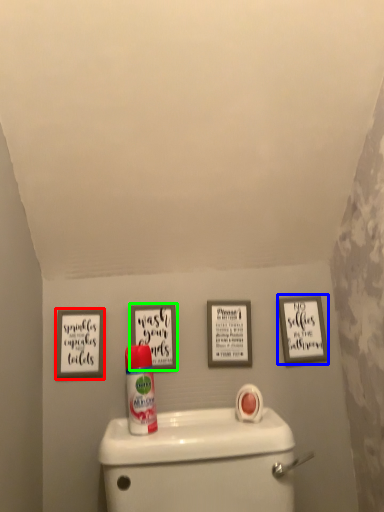
Question: Which object is positioned closest to picture frame (highlighted by a red box)? Select from picture frame (highlighted by a blue box) and picture frame (highlighted by a green box).

Choices:
 (A) picture frame
 (B) picture frame

Answer: (B)